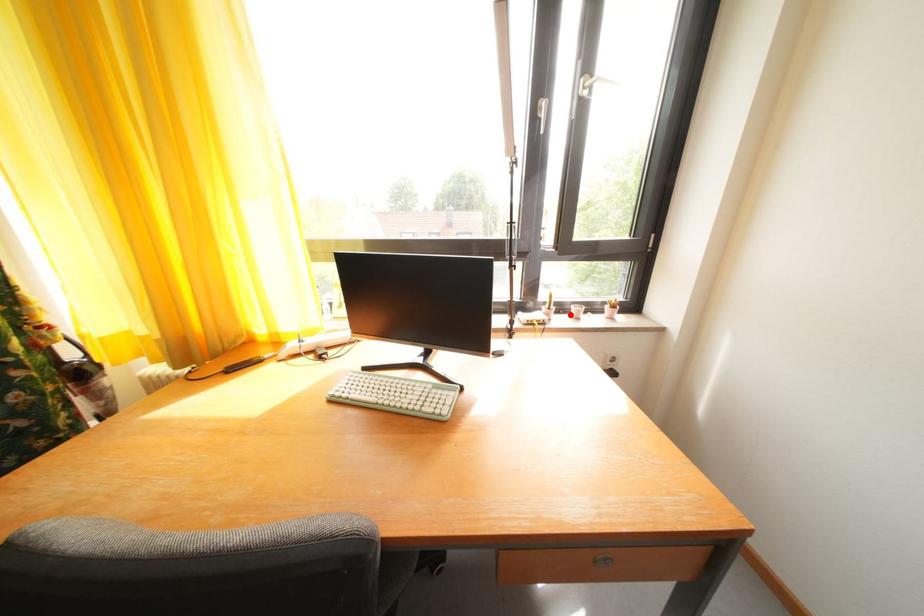
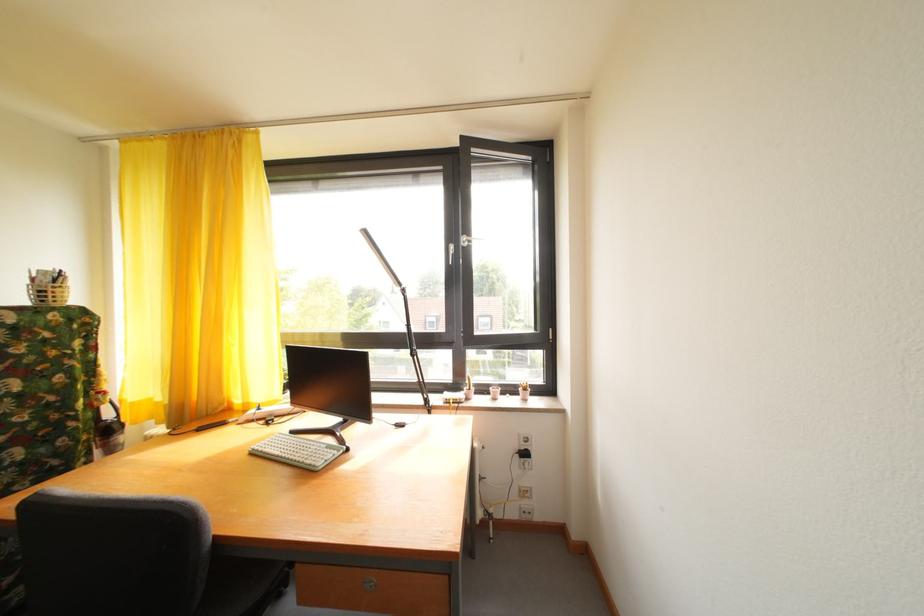
Question: I am providing you with two images of the same scene from different viewpoints. A red point is marked on the first image. Is the red point's position out of view in image 2?

Choices:
 (A) Yes
 (B) No

Answer: (B)